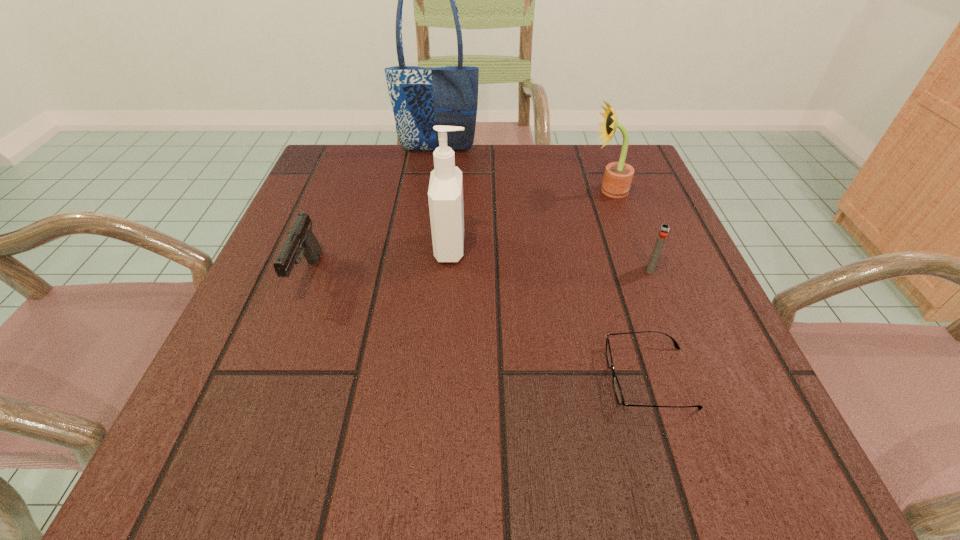
This screenshot has height=540, width=960. Find the location of `shopping bag`. shopping bag is located at coordinates point(421,98).

This screenshot has width=960, height=540. What are the coordinates of `the tallest object` in the screenshot? It's located at (421, 98).

This screenshot has height=540, width=960. In order to click on the second tallest object in this screenshot , I will do `click(445, 194)`.

Find the location of a particular element. This screenshot has width=960, height=540. sunflower is located at coordinates (618, 176).

Find the location of `the fifth nearest object`. the fifth nearest object is located at coordinates (618, 176).

At what (x,y) coordinates should I click in order to perform the action: click on the leftmost object. Please return your answer as a coordinate pair (x, y). This screenshot has width=960, height=540. Looking at the image, I should click on (300, 241).

The height and width of the screenshot is (540, 960). In order to click on igniter in this screenshot , I will do [x=663, y=232].

Locate an element on the screen. Image resolution: width=960 pixels, height=540 pixels. the nearest object is located at coordinates (616, 386).

Find the location of a particular element. This screenshot has width=960, height=540. spectacles is located at coordinates (616, 386).

Locate an element on the screen. Image resolution: width=960 pixels, height=540 pixels. free region located 0.060m on the front-facing side of the shopping bag is located at coordinates (435, 167).